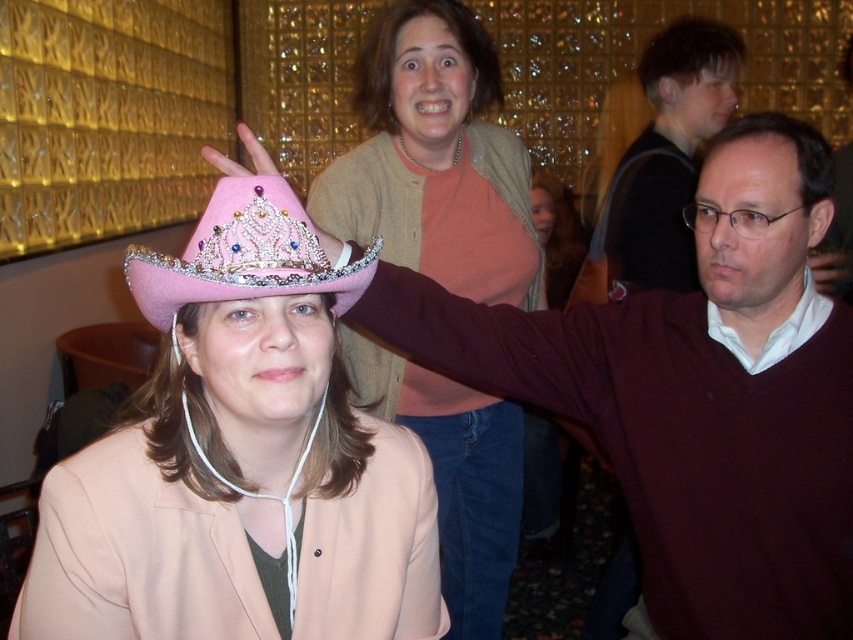
Is pink felt hat at lower left wider than matte pink sweater at center?

No, pink felt hat at lower left is not wider than matte pink sweater at center.

Who is positioned more to the right, pink felt hat at lower left or matte pink sweater at center?

matte pink sweater at center is more to the right.

Between point (245, 525) and point (773, 566), which one is positioned in front?

Positioned in front is point (245, 525).

The width and height of the screenshot is (853, 640). What are the coordinates of `pink felt hat at lower left` in the screenshot? It's located at (241, 460).

What do you see at coordinates (434, 160) in the screenshot? This screenshot has width=853, height=640. I see `pink fabric tiara at upper center` at bounding box center [434, 160].

Can you confirm if pink fabric tiara at upper center is positioned to the right of pink felt sombrero at center?

Correct, you'll find pink fabric tiara at upper center to the right of pink felt sombrero at center.

Who is more forward, (432, 179) or (299, 221)?

Point (299, 221) is more forward.

Where is `pink fabric tiara at upper center`? The width and height of the screenshot is (853, 640). pink fabric tiara at upper center is located at coordinates (434, 160).

Between point (825, 595) and point (309, 189), which one is positioned behind?

The point (309, 189) is behind.

Consider the image. Who is shorter, matte pink sweater at center or pink fabric tiara at upper center?

With less height is matte pink sweater at center.

Between point (764, 256) and point (363, 218), which one is positioned behind?

Positioned behind is point (363, 218).

Locate an element on the screen. The image size is (853, 640). matte pink sweater at center is located at coordinates (672, 442).